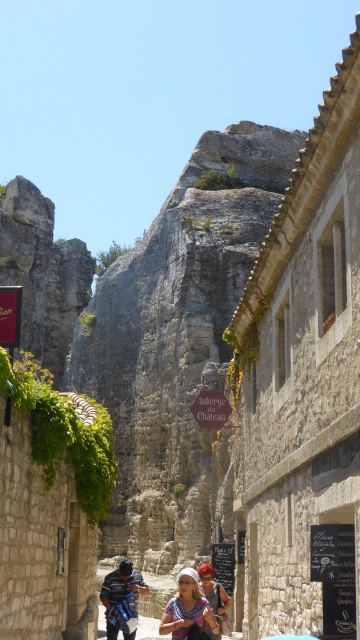
Is the position of gray stone rock at center less distant than that of blonde hair at center?

No.

Between gray stone rock at center and blonde hair at center, which one is positioned higher?

gray stone rock at center

Which is in front, point (142, 433) or point (191, 602)?

Point (191, 602) is more forward.

This screenshot has height=640, width=360. Find the location of `gray stone rock at center`. gray stone rock at center is located at coordinates (177, 344).

Looking at this image, is blonde hair at center to the right of blue denim jacket at center from the viewer's perspective?

Correct, you'll find blonde hair at center to the right of blue denim jacket at center.

Is blonde hair at center thinner than blue denim jacket at center?

Correct, blonde hair at center's width is less than blue denim jacket at center's.

What do you see at coordinates (187, 609) in the screenshot? I see `blonde hair at center` at bounding box center [187, 609].

Locate an element on the screen. The height and width of the screenshot is (640, 360). blonde hair at center is located at coordinates (187, 609).

Between blue denim jacket at center and matte white shirt at center, which one is positioned higher?

matte white shirt at center is above.

Where is `blue denim jacket at center`? This screenshot has width=360, height=640. blue denim jacket at center is located at coordinates (122, 598).

Find the location of `blue denim jacket at center`. blue denim jacket at center is located at coordinates (122, 598).